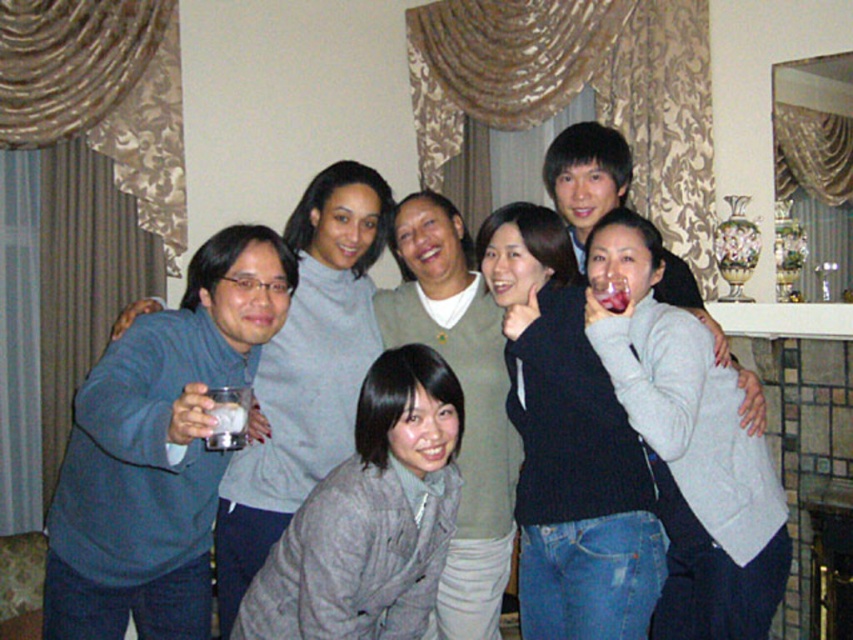
Can you confirm if matte glass cup at center-left is shorter than gray fuzzy coat at lower center?

Incorrect, matte glass cup at center-left's height does not fall short of gray fuzzy coat at lower center's.

Can you confirm if matte glass cup at center-left is taller than gray fuzzy coat at lower center?

Correct, matte glass cup at center-left is much taller as gray fuzzy coat at lower center.

Between point (209, 483) and point (448, 452), which one is positioned behind?

The point (209, 483) is more distant.

Find the location of a particular element. This screenshot has height=640, width=853. matte glass cup at center-left is located at coordinates (158, 449).

Who is more forward, [605,452] or [412,428]?

Point [412,428]

Is dark blue sweater at center above gray fuzzy coat at lower center?

Yes, dark blue sweater at center is above gray fuzzy coat at lower center.

Is point (538, 625) positioned in front of point (451, 397)?

No.

Find the location of a particular element. This screenshot has width=853, height=640. dark blue sweater at center is located at coordinates (567, 445).

Between matte glass cup at center-left and clear glass at upper center, which one has more height?

matte glass cup at center-left

Looking at this image, is matte glass cup at center-left wider than clear glass at upper center?

Correct, the width of matte glass cup at center-left exceeds that of clear glass at upper center.

What are the coordinates of `matte glass cup at center-left` in the screenshot? It's located at (158, 449).